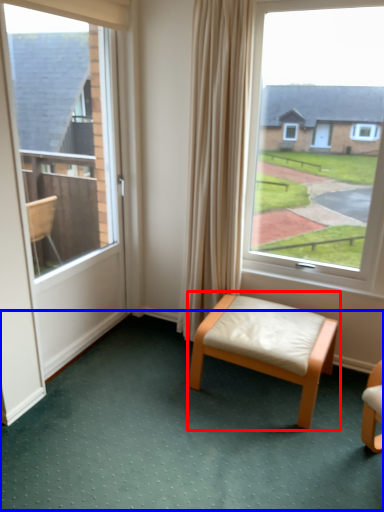
Question: Which object appears farthest to the camera in this image, stool (highlighted by a red box) or golf course (highlighted by a blue box)?

Choices:
 (A) stool
 (B) golf course

Answer: (A)